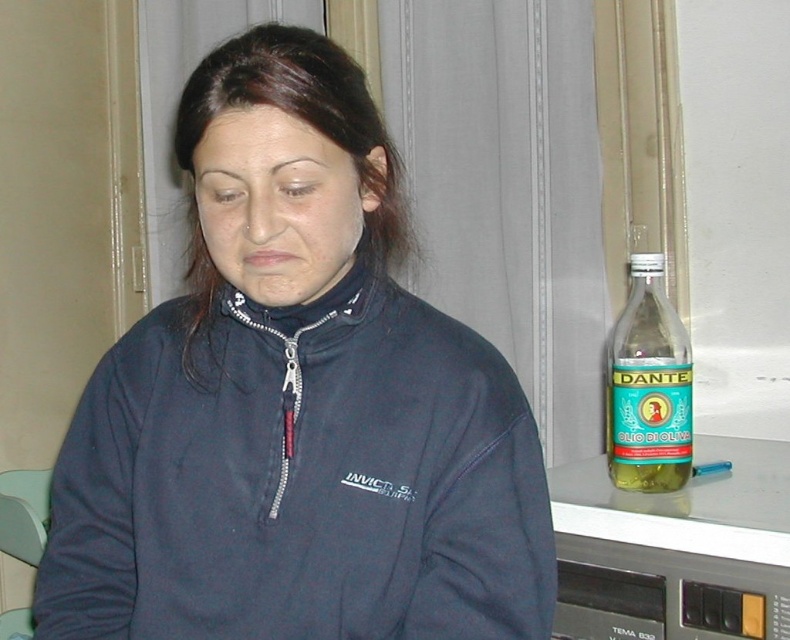
Question: Is dark blue fleece at center further to camera compared to green glass bottle at right?

Choices:
 (A) no
 (B) yes

Answer: (A)

Question: Can you confirm if dark blue fleece at center is wider than green glass bottle at right?

Choices:
 (A) no
 (B) yes

Answer: (B)

Question: Which object appears farthest from the camera in this image?

Choices:
 (A) dark blue fleece at center
 (B) green glass bottle at right

Answer: (B)

Question: Among these points, which one is nearest to the camera?

Choices:
 (A) (660, 305)
 (B) (457, 444)

Answer: (B)

Question: Can you confirm if dark blue fleece at center is positioned to the right of green glass bottle at right?

Choices:
 (A) no
 (B) yes

Answer: (A)